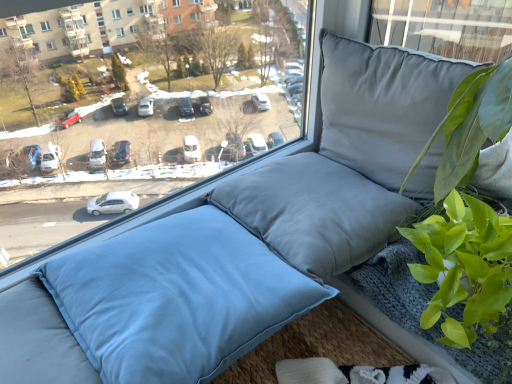
Question: Is light blue fabric pillow at center, which is the 3th pillow from top to bottom, inside the boundaries of gray fabric pillow at upper right, arranged as the first pillow when viewed from the top, or outside?

Choices:
 (A) outside
 (B) inside

Answer: (A)

Question: Would you say light blue fabric pillow at center, which is the 3th pillow from top to bottom, is to the left or to the right of gray fabric pillow at upper right, placed as the third pillow when sorted from bottom to top, in the picture?

Choices:
 (A) left
 (B) right

Answer: (A)

Question: Which of these objects is positioned closest to the light blue fabric pillow at center, which is the 3th pillow from top to bottom?

Choices:
 (A) satin gray pillow at center, which ranks as the 2th pillow in bottom-to-top order
 (B) matte gray cushion at center
 (C) green leafy plant at right
 (D) gray fabric pillow at upper right, arranged as the first pillow when viewed from the top

Answer: (A)

Question: Which of these objects is positioned closest to the satin gray pillow at center, which ranks as the 2th pillow in bottom-to-top order?

Choices:
 (A) gray fabric pillow at upper right, arranged as the first pillow when viewed from the top
 (B) light blue fabric pillow at center, the 1th pillow ordered from the bottom
 (C) green leafy plant at right
 (D) matte gray cushion at center

Answer: (A)